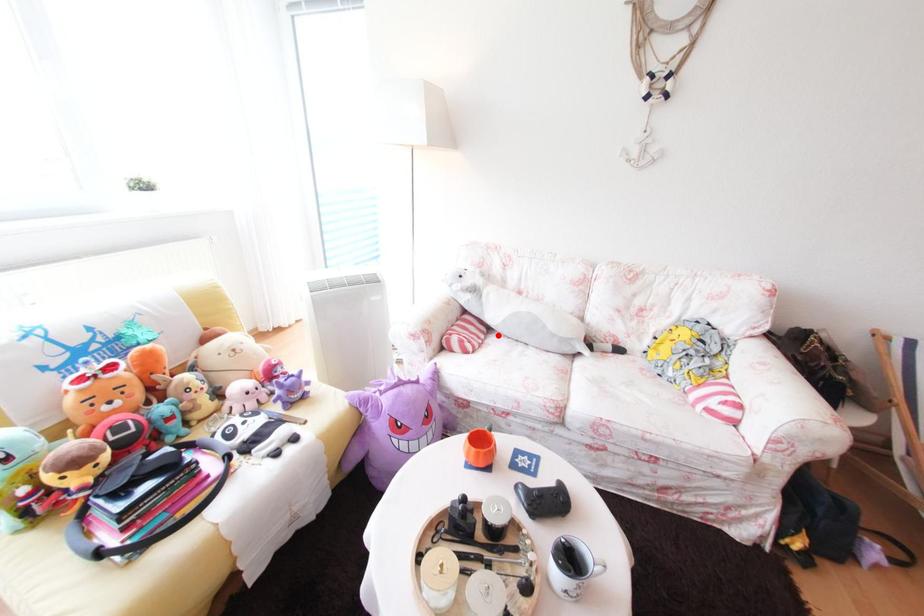
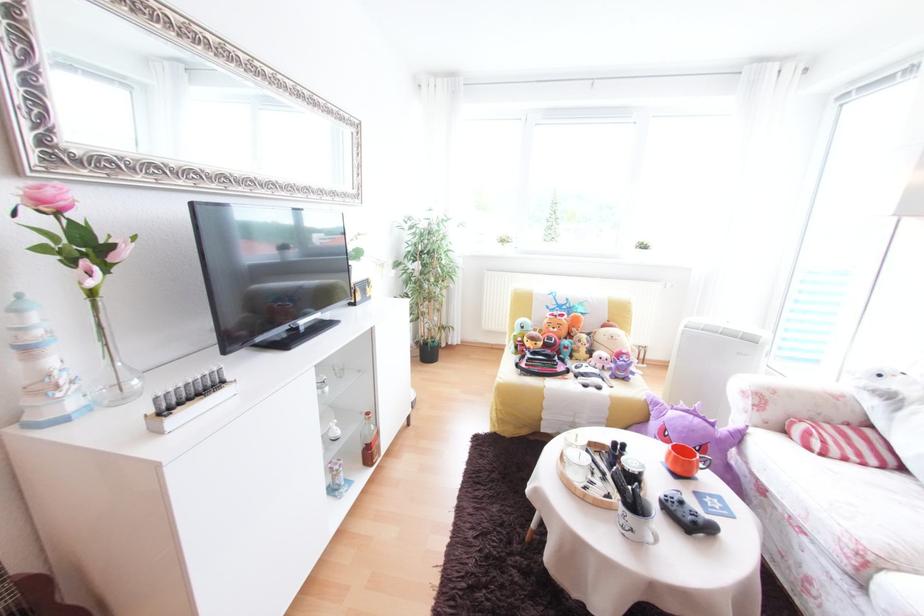
In the second image, find the point that corresponds to the highlighted location in the first image.

(907, 472)